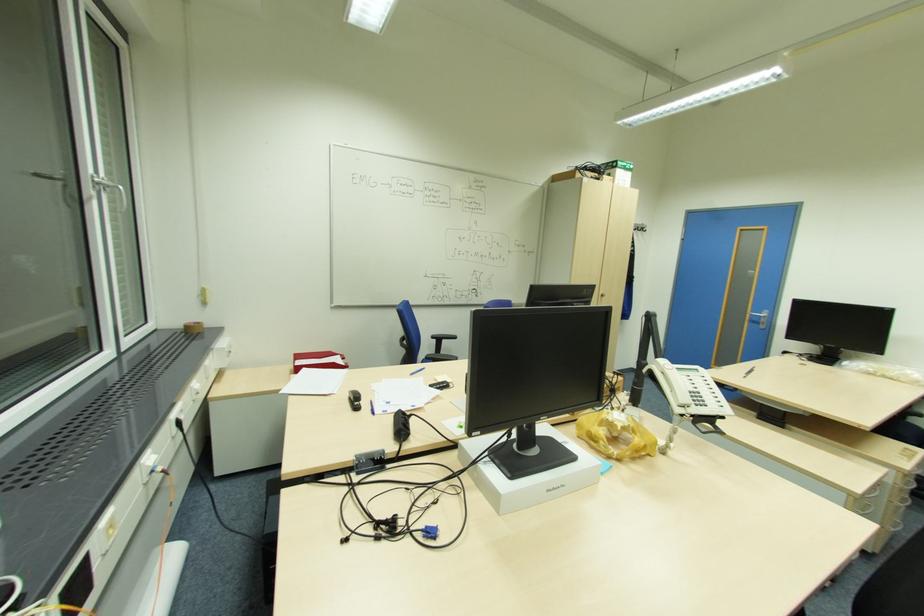
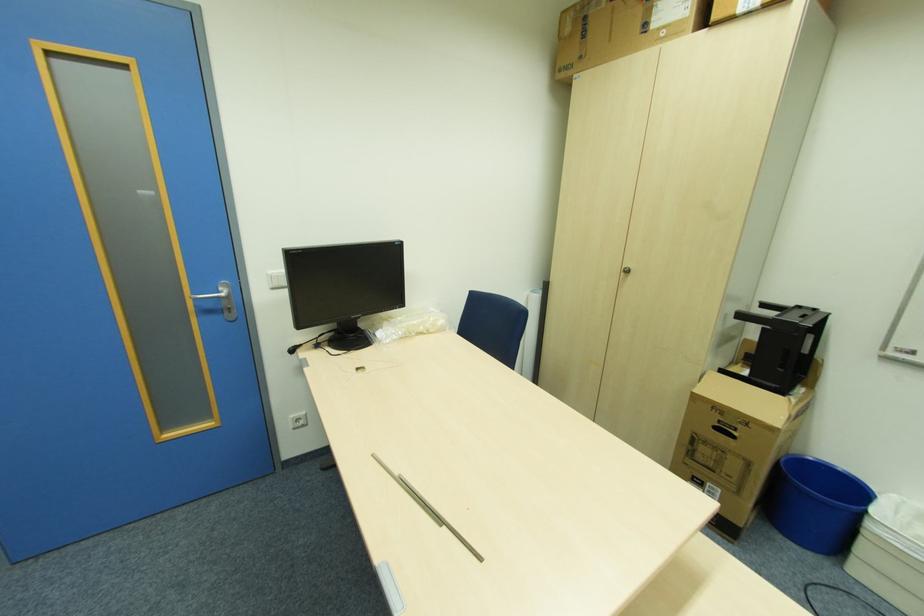
Where in the second image is the point corresponding to the point at 892,374 from the first image?

(424, 329)